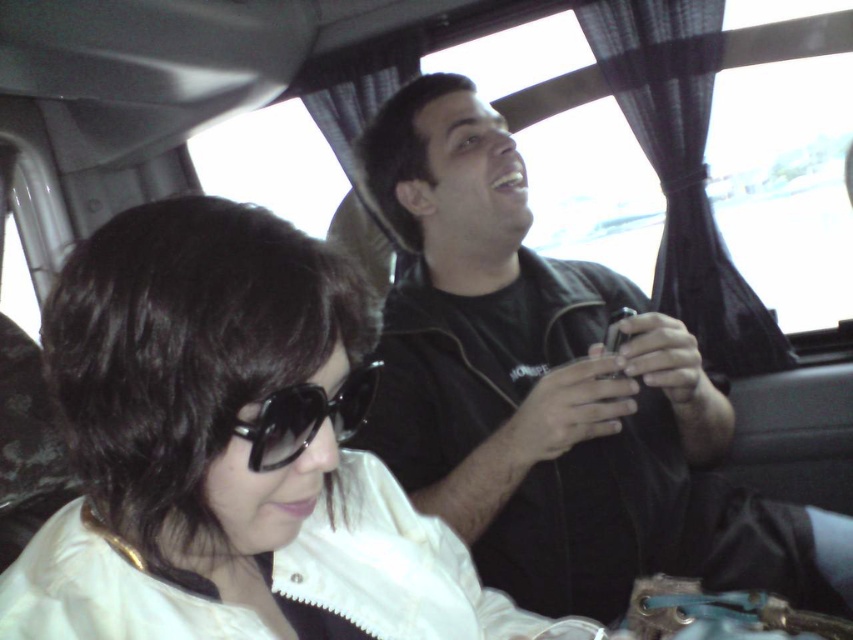
Between point (437, 205) and point (259, 448), which one is positioned in front?

Point (259, 448) is in front.

Which of these two, black matte shirt at center or black plastic sunglasses at center, stands taller?

Standing taller between the two is black matte shirt at center.

Which is behind, point (601, 419) or point (315, 387)?

The point (601, 419) is behind.

Find the location of a particular element. The height and width of the screenshot is (640, 853). black matte shirt at center is located at coordinates (554, 394).